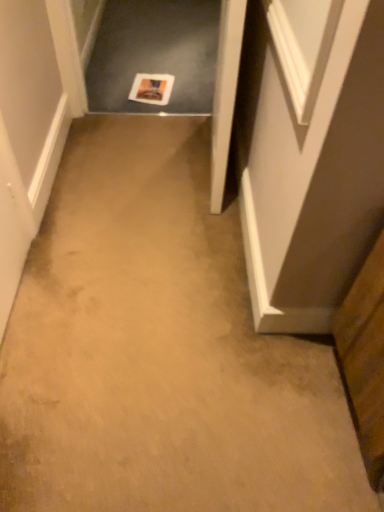
What do you see at coordinates (365, 359) in the screenshot? I see `wooden cabinet at lower right` at bounding box center [365, 359].

This screenshot has height=512, width=384. Find the location of `white wood door at center`. white wood door at center is located at coordinates [x=225, y=94].

Is point (197, 19) farther from viewer compared to point (365, 356)?

Yes, point (197, 19) is farther from viewer.

From the image's perspective, between white paper at center and wooden cabinet at lower right, who is located below?

wooden cabinet at lower right appears lower in the image.

Is wooden cabinet at lower right surrounded by white paper at center?

No.

From a real-world perspective, between white paper at center and wooden cabinet at lower right, who is vertically higher?

wooden cabinet at lower right is physically above.

From a real-world perspective, is white wood door at center located higher than white paper at center?

Yes, from a real-world perspective, white wood door at center is over white paper at center

How far apart are white wood door at center and white paper at center?

A distance of 3.93 feet exists between white wood door at center and white paper at center.

Based on their sizes in the image, would you say white wood door at center is bigger or smaller than white paper at center?

white wood door at center is bigger than white paper at center.

Consider the image. Are white wood door at center and white paper at center far apart?

Absolutely, white wood door at center is distant from white paper at center.

Is white paper at center at the back of wooden cabinet at lower right?

No, wooden cabinet at lower right is not facing away from white paper at center.

From a real-world perspective, who is located higher, wooden cabinet at lower right or white paper at center?

wooden cabinet at lower right is physically above.

Which is more to the left, wooden cabinet at lower right or white paper at center?

white paper at center is more to the left.

Considering the sizes of objects wooden cabinet at lower right and white paper at center in the image provided, who is taller, wooden cabinet at lower right or white paper at center?

With more height is wooden cabinet at lower right.

From the image's perspective, which one is positioned lower, white wood door at center or wooden cabinet at lower right?

From the image's view, wooden cabinet at lower right is below.

Considering the relative sizes of white wood door at center and wooden cabinet at lower right in the image provided, is white wood door at center smaller than wooden cabinet at lower right?

Actually, white wood door at center might be larger than wooden cabinet at lower right.

Where is `cabinetry below the white wood door at center (from a real-world perspective)`? This screenshot has width=384, height=512. cabinetry below the white wood door at center (from a real-world perspective) is located at coordinates (365, 359).

From a real-world perspective, is white paper at center positioned under white wood door at center based on gravity?

Yes, from a real-world perspective, white paper at center is under white wood door at center.

Is the surface of white paper at center in direct contact with white wood door at center?

No, white paper at center is not next to white wood door at center.

Considering the relative positions of white paper at center and white wood door at center in the image provided, is white paper at center to the left of white wood door at center from the viewer's perspective?

Indeed, white paper at center is positioned on the left side of white wood door at center.

From the image's perspective, which is below, white paper at center or white wood door at center?

white wood door at center is shown below in the image.

Are wooden cabinet at lower right and white wood door at center far apart?

That's not correct — wooden cabinet at lower right is a little close to white wood door at center.

Between wooden cabinet at lower right and white wood door at center, which one appears on the right side from the viewer's perspective?

wooden cabinet at lower right is more to the right.

Which object is closer to the camera, wooden cabinet at lower right or white wood door at center?

Positioned in front is wooden cabinet at lower right.

From a real-world perspective, relative to white wood door at center, is wooden cabinet at lower right vertically above or below?

Clearly, from a real-world perspective, wooden cabinet at lower right is below white wood door at center.

What are the coordinates of `cabinetry below the white paper at center (from the image's perspective)` in the screenshot? It's located at (365, 359).

Locate an element on the screen. passage that appears behind the white wood door at center is located at coordinates (155, 54).

From the image, which object appears to be farther from white wood door at center, white paper at center or wooden cabinet at lower right?

white paper at center is further to white wood door at center.

When comparing their distances from white paper at center, does wooden cabinet at lower right or white wood door at center seem closer?

Among the two, white wood door at center is located nearer to white paper at center.

From the image, which object appears to be farther from white wood door at center, wooden cabinet at lower right or white paper at center?

white paper at center is further to white wood door at center.

Which object lies further to the anchor point wooden cabinet at lower right, white paper at center or white wood door at center?

Based on the image, white paper at center appears to be further to wooden cabinet at lower right.

When comparing their distances from wooden cabinet at lower right, does white wood door at center or white paper at center seem further?

Among the two, white paper at center is located further to wooden cabinet at lower right.

When comparing their distances from white paper at center, does white wood door at center or wooden cabinet at lower right seem closer?

→ The object closer to white paper at center is white wood door at center.

Where is `door between white paper at center and wooden cabinet at lower right from top to bottom`? door between white paper at center and wooden cabinet at lower right from top to bottom is located at coordinates (225, 94).